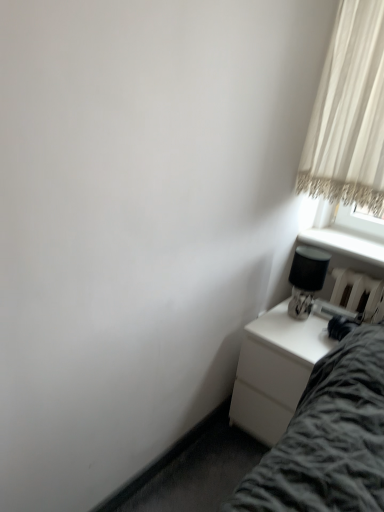
Question: From a real-world perspective, is white glossy nightstand at lower right below white sheer curtain at upper right?

Choices:
 (A) yes
 (B) no

Answer: (A)

Question: Considering the relative sizes of white glossy nightstand at lower right and white sheer curtain at upper right in the image provided, is white glossy nightstand at lower right bigger than white sheer curtain at upper right?

Choices:
 (A) yes
 (B) no

Answer: (A)

Question: Would you say white glossy nightstand at lower right is a long distance from white sheer curtain at upper right?

Choices:
 (A) no
 (B) yes

Answer: (A)

Question: Considering the relative positions of white glossy nightstand at lower right and white sheer curtain at upper right in the image provided, is white glossy nightstand at lower right behind white sheer curtain at upper right?

Choices:
 (A) no
 (B) yes

Answer: (B)

Question: Considering the relative sizes of white glossy nightstand at lower right and white sheer curtain at upper right in the image provided, is white glossy nightstand at lower right smaller than white sheer curtain at upper right?

Choices:
 (A) no
 (B) yes

Answer: (A)

Question: Does white glossy nightstand at lower right touch white sheer curtain at upper right?

Choices:
 (A) no
 (B) yes

Answer: (A)

Question: Is white sheer curtain at upper right at the right side of black glossy table lamp at right?

Choices:
 (A) no
 (B) yes

Answer: (B)

Question: From the image's perspective, is white sheer curtain at upper right located above black glossy table lamp at right?

Choices:
 (A) no
 (B) yes

Answer: (B)

Question: Is white sheer curtain at upper right further to camera compared to black glossy table lamp at right?

Choices:
 (A) no
 (B) yes

Answer: (A)

Question: Is white sheer curtain at upper right thinner than black glossy table lamp at right?

Choices:
 (A) yes
 (B) no

Answer: (B)

Question: From a real-world perspective, is white sheer curtain at upper right positioned over black glossy table lamp at right based on gravity?

Choices:
 (A) no
 (B) yes

Answer: (B)

Question: Would you say white sheer curtain at upper right contains black glossy table lamp at right?

Choices:
 (A) no
 (B) yes

Answer: (A)

Question: Can you confirm if black glossy table lamp at right is smaller than white sheer curtain at upper right?

Choices:
 (A) no
 (B) yes

Answer: (B)